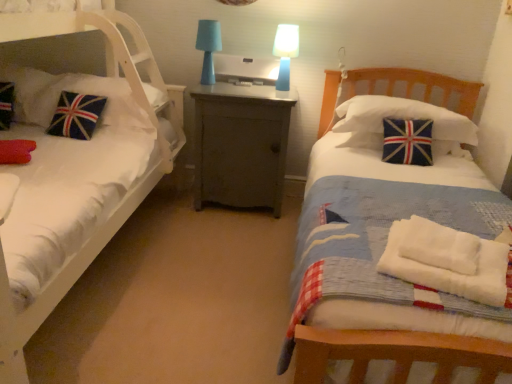
Question: Which direction should I rotate to face blue plastic table lamp at upper center, marked as the first table lamp in a right-to-left arrangement, — up or down?

Choices:
 (A) up
 (B) down

Answer: (A)

Question: Can you confirm if white fabric bed at left is smaller than velvet union jack pillow at left, placed as the 2th pillow when sorted from right to left?

Choices:
 (A) yes
 (B) no

Answer: (B)

Question: From a real-world perspective, is white fabric bed at left beneath velvet union jack pillow at left, which ranks as the 2th pillow in left-to-right order?

Choices:
 (A) yes
 (B) no

Answer: (A)

Question: Is white fabric bed at left facing towards velvet union jack pillow at left, which ranks as the 2th pillow in left-to-right order?

Choices:
 (A) yes
 (B) no

Answer: (B)

Question: From a real-world perspective, is white fabric bed at left physically above velvet union jack pillow at left, which ranks as the 2th pillow in left-to-right order?

Choices:
 (A) no
 (B) yes

Answer: (A)

Question: Is white fabric bed at left turned away from velvet union jack pillow at left, placed as the 2th pillow when sorted from right to left?

Choices:
 (A) no
 (B) yes

Answer: (B)

Question: Does white fabric bed at left have a lesser height compared to velvet union jack pillow at left, placed as the 2th pillow when sorted from right to left?

Choices:
 (A) no
 (B) yes

Answer: (A)

Question: From a real-world perspective, does white fabric bed at left stand above blue fabric lampshade at center, arranged as the first table lamp when viewed from the left?

Choices:
 (A) no
 (B) yes

Answer: (A)

Question: Does white fabric bed at left touch blue fabric lampshade at center, arranged as the first table lamp when viewed from the left?

Choices:
 (A) yes
 (B) no

Answer: (B)

Question: From a real-world perspective, does white fabric bed at left sit lower than blue fabric lampshade at center, which is counted as the second table lamp, starting from the right?

Choices:
 (A) no
 (B) yes

Answer: (B)

Question: Is white fabric bed at left taller than blue fabric lampshade at center, which is counted as the second table lamp, starting from the right?

Choices:
 (A) no
 (B) yes

Answer: (B)

Question: Could you tell me if white fabric bed at left is turned towards blue fabric lampshade at center, arranged as the first table lamp when viewed from the left?

Choices:
 (A) no
 (B) yes

Answer: (A)

Question: Can you confirm if white fabric bed at left is thinner than blue fabric lampshade at center, which is counted as the second table lamp, starting from the right?

Choices:
 (A) no
 (B) yes

Answer: (A)

Question: Does blue plastic table lamp at upper center, marked as the first table lamp in a right-to-left arrangement, turn towards white cotton towels at lower right?

Choices:
 (A) yes
 (B) no

Answer: (B)